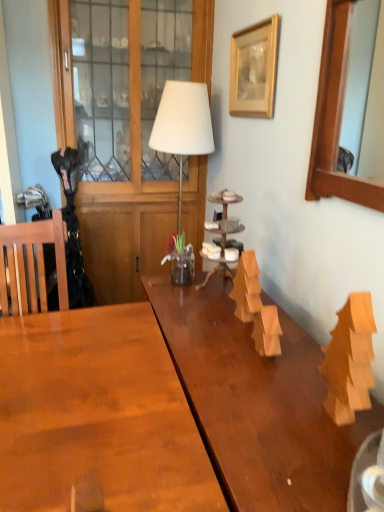
Question: Which is correct: wooden picture frame at upper center, the second picture frame in the front-to-back sequence, is inside wooden mirror at upper right, the 2th picture frame when ordered from left to right, or outside of it?

Choices:
 (A) inside
 (B) outside

Answer: (B)

Question: In terms of size, does wooden picture frame at upper center, which appears as the 2th picture frame when viewed from the right, appear bigger or smaller than wooden mirror at upper right, the 1th picture frame when ordered from right to left?

Choices:
 (A) big
 (B) small

Answer: (B)

Question: Estimate the real-world distances between objects in this image. Which object is farther from the white matte table lamp at center?

Choices:
 (A) wooden picture frame at upper center, which is the first picture frame in left-to-right order
 (B) wooden cabinet at left
 (C) wooden mirror at upper right, the 1th picture frame when ordered from right to left

Answer: (C)

Question: Considering the real-world distances, which object is closest to the wooden mirror at upper right, arranged as the 1th picture frame when viewed from the front?

Choices:
 (A) wooden cabinet at left
 (B) wooden picture frame at upper center, marked as the first picture frame in a back-to-front arrangement
 (C) white matte table lamp at center

Answer: (B)